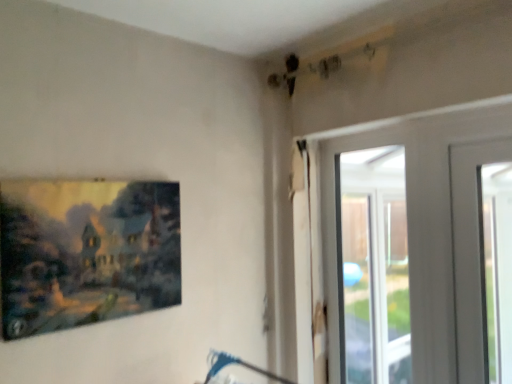
Question: Does matte canvas painting at left appear on the right side of transparent glass door at upper right?

Choices:
 (A) yes
 (B) no

Answer: (B)

Question: Considering the relative sizes of matte canvas painting at left and transparent glass door at upper right in the image provided, is matte canvas painting at left smaller than transparent glass door at upper right?

Choices:
 (A) no
 (B) yes

Answer: (B)

Question: From the image's perspective, is matte canvas painting at left on transparent glass door at upper right?

Choices:
 (A) yes
 (B) no

Answer: (A)

Question: Is matte canvas painting at left not inside transparent glass door at upper right?

Choices:
 (A) no
 (B) yes

Answer: (B)

Question: Is matte canvas painting at left taller than transparent glass door at upper right?

Choices:
 (A) no
 (B) yes

Answer: (A)

Question: From a real-world perspective, is matte canvas painting at left physically above transparent glass door at upper right?

Choices:
 (A) yes
 (B) no

Answer: (A)

Question: From the image's perspective, would you say transparent glass door at upper right is positioned over matte canvas painting at left?

Choices:
 (A) no
 (B) yes

Answer: (A)

Question: Does transparent glass door at upper right have a lesser height compared to matte canvas painting at left?

Choices:
 (A) yes
 (B) no

Answer: (B)

Question: Is the depth of transparent glass door at upper right less than that of matte canvas painting at left?

Choices:
 (A) no
 (B) yes

Answer: (A)

Question: From a real-world perspective, is transparent glass door at upper right positioned under matte canvas painting at left based on gravity?

Choices:
 (A) yes
 (B) no

Answer: (A)

Question: Is transparent glass door at upper right positioned far away from matte canvas painting at left?

Choices:
 (A) no
 (B) yes

Answer: (B)

Question: Is transparent glass door at upper right positioned beyond the bounds of matte canvas painting at left?

Choices:
 (A) no
 (B) yes

Answer: (B)

Question: Is transparent glass door at upper right situated inside matte canvas painting at left or outside?

Choices:
 (A) inside
 (B) outside

Answer: (B)